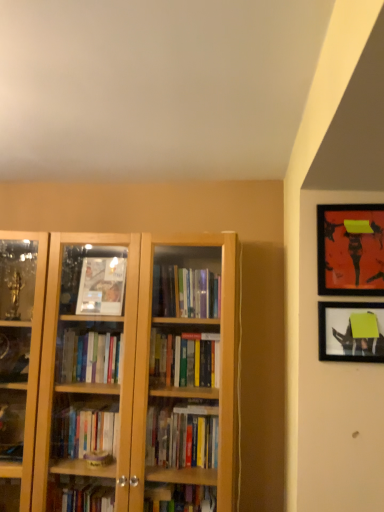
Question: Is matte black picture frame at upper right, which is the second picture frame from bottom to top, oriented towards matte black picture frame at upper right, the first picture frame positioned from the bottom?

Choices:
 (A) no
 (B) yes

Answer: (A)

Question: Can you confirm if matte black picture frame at upper right, the 1th picture frame positioned from the top, is smaller than matte black picture frame at upper right, the first picture frame positioned from the bottom?

Choices:
 (A) yes
 (B) no

Answer: (B)

Question: From a real-world perspective, is matte black picture frame at upper right, the 1th picture frame positioned from the top, positioned over matte black picture frame at upper right, the first picture frame positioned from the bottom, based on gravity?

Choices:
 (A) yes
 (B) no

Answer: (A)

Question: Is matte black picture frame at upper right, which is the second picture frame from bottom to top, beside matte black picture frame at upper right, the 2th picture frame positioned from the top?

Choices:
 (A) no
 (B) yes

Answer: (A)

Question: Considering the relative sizes of matte black picture frame at upper right, which is the second picture frame from bottom to top, and matte black picture frame at upper right, the 2th picture frame positioned from the top, in the image provided, is matte black picture frame at upper right, which is the second picture frame from bottom to top, wider than matte black picture frame at upper right, the 2th picture frame positioned from the top,?

Choices:
 (A) no
 (B) yes

Answer: (B)

Question: From the image's perspective, is matte black picture frame at upper right, which is the second picture frame from bottom to top, under matte black picture frame at upper right, the 2th picture frame positioned from the top?

Choices:
 (A) no
 (B) yes

Answer: (A)

Question: Does matte black picture frame at upper right, the 2th picture frame positioned from the top, have a smaller size compared to matte black picture frame at upper right, the 1th picture frame positioned from the top?

Choices:
 (A) no
 (B) yes

Answer: (B)

Question: Does matte black picture frame at upper right, the 2th picture frame positioned from the top, have a larger size compared to matte black picture frame at upper right, the 1th picture frame positioned from the top?

Choices:
 (A) yes
 (B) no

Answer: (B)

Question: Can you confirm if matte black picture frame at upper right, the 2th picture frame positioned from the top, is wider than matte black picture frame at upper right, the 1th picture frame positioned from the top?

Choices:
 (A) no
 (B) yes

Answer: (A)

Question: From a real-world perspective, is matte black picture frame at upper right, the first picture frame positioned from the bottom, located higher than matte black picture frame at upper right, the 1th picture frame positioned from the top?

Choices:
 (A) no
 (B) yes

Answer: (A)

Question: Would you consider matte black picture frame at upper right, the first picture frame positioned from the bottom, to be distant from matte black picture frame at upper right, which is the second picture frame from bottom to top?

Choices:
 (A) yes
 (B) no

Answer: (B)

Question: Is the surface of matte black picture frame at upper right, the 2th picture frame positioned from the top, in direct contact with matte black picture frame at upper right, which is the second picture frame from bottom to top?

Choices:
 (A) yes
 (B) no

Answer: (B)

Question: In the image, is matte black picture frame at upper right, the 2th picture frame positioned from the top, positioned in front of or behind matte black picture frame at upper right, the 1th picture frame positioned from the top?

Choices:
 (A) behind
 (B) front

Answer: (A)